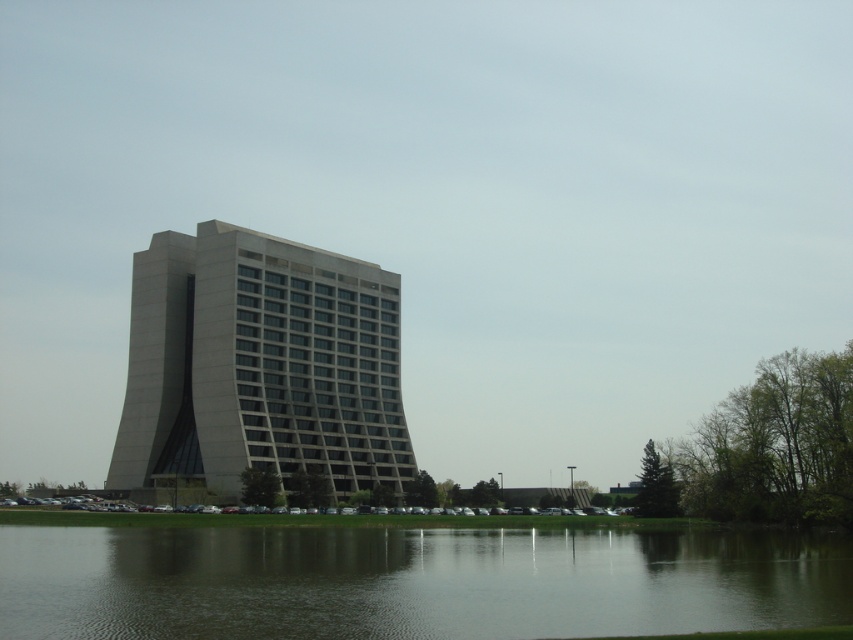
You are standing on the grassy area in front of the gray concrete building at center. You want to walk to the dark green water at lower center. Which direction should you head towards?

The dark green water at lower center is to the right of the gray concrete building at center, so you should head towards the right direction to reach it.

You are a visitor standing on the grassy area in front of the gray concrete building at center. You want to take a photo of the building with the dark green water at lower center in the foreground. Will the water appear smaller or larger in the photo compared to the building?

The dark green water at lower center is not as tall as the gray concrete building at center, so in the photo, the water will appear smaller than the building.